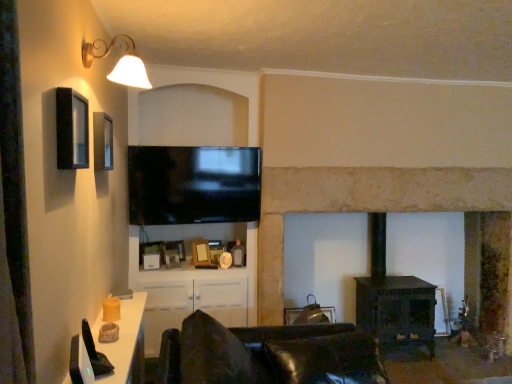
Question: Can you see matte glass window at upper left touching white glossy table at lower left?

Choices:
 (A) no
 (B) yes

Answer: (A)

Question: From the image's perspective, would you say matte glass window at upper left is positioned over white glossy table at lower left?

Choices:
 (A) yes
 (B) no

Answer: (A)

Question: Can we say matte glass window at upper left lies outside white glossy table at lower left?

Choices:
 (A) yes
 (B) no

Answer: (A)

Question: Can you confirm if matte glass window at upper left is thinner than white glossy table at lower left?

Choices:
 (A) no
 (B) yes

Answer: (B)

Question: Does matte glass window at upper left have a lesser height compared to white glossy table at lower left?

Choices:
 (A) yes
 (B) no

Answer: (B)

Question: From a real-world perspective, is stone fireplace at center positioned above or below matte black picture frame at upper left, the 1th picture frame viewed from the front?

Choices:
 (A) above
 (B) below

Answer: (B)

Question: In terms of width, does stone fireplace at center look wider or thinner when compared to matte black picture frame at upper left, which ranks as the first picture frame in top-to-bottom order?

Choices:
 (A) thin
 (B) wide

Answer: (B)

Question: Is stone fireplace at center in front of or behind matte black picture frame at upper left, the second picture frame ordered from the bottom, in the image?

Choices:
 (A) behind
 (B) front

Answer: (A)

Question: Which is correct: stone fireplace at center is inside matte black picture frame at upper left, the second picture frame ordered from the bottom, or outside of it?

Choices:
 (A) outside
 (B) inside

Answer: (A)

Question: From the image's perspective, is gold metallic wall sconce at upper left located above or below black glossy tv at center?

Choices:
 (A) below
 (B) above

Answer: (B)

Question: In terms of height, does gold metallic wall sconce at upper left look taller or shorter compared to black glossy tv at center?

Choices:
 (A) short
 (B) tall

Answer: (A)

Question: From a real-world perspective, is gold metallic wall sconce at upper left above or below black glossy tv at center?

Choices:
 (A) above
 (B) below

Answer: (A)

Question: Considering the positions of gold metallic wall sconce at upper left and black glossy tv at center in the image, is gold metallic wall sconce at upper left wider or thinner than black glossy tv at center?

Choices:
 (A) wide
 (B) thin

Answer: (A)

Question: In terms of width, does matte glass window at upper left look wider or thinner when compared to leather couch at center?

Choices:
 (A) wide
 (B) thin

Answer: (B)

Question: From the image's perspective, is matte glass window at upper left above or below leather couch at center?

Choices:
 (A) above
 (B) below

Answer: (A)